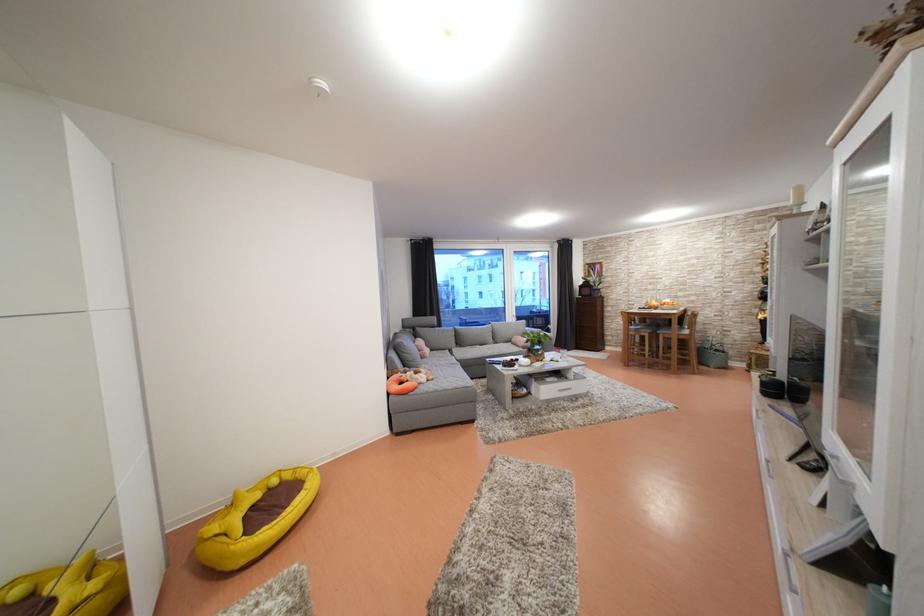
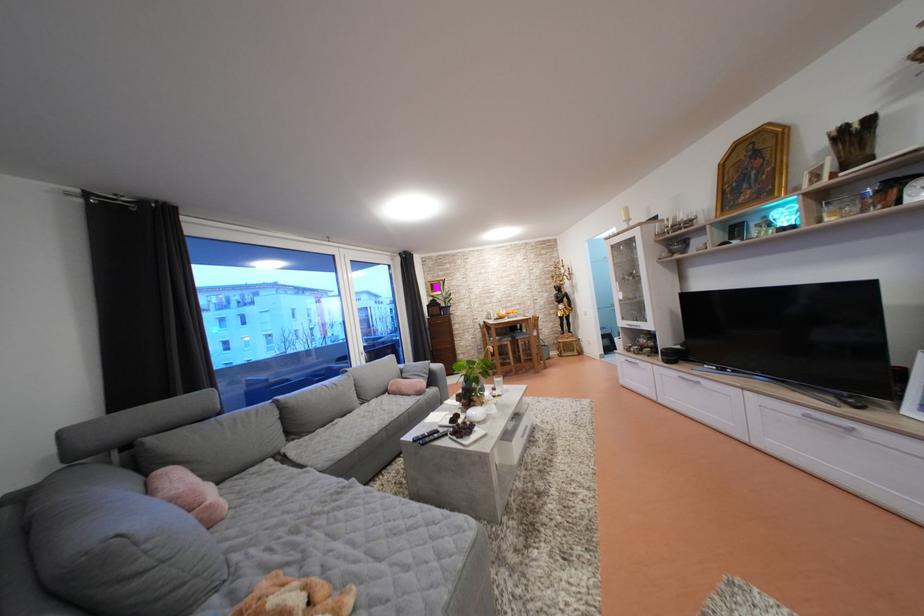
Find the pixel in the second image that matches point (535, 334) in the first image.

(408, 371)